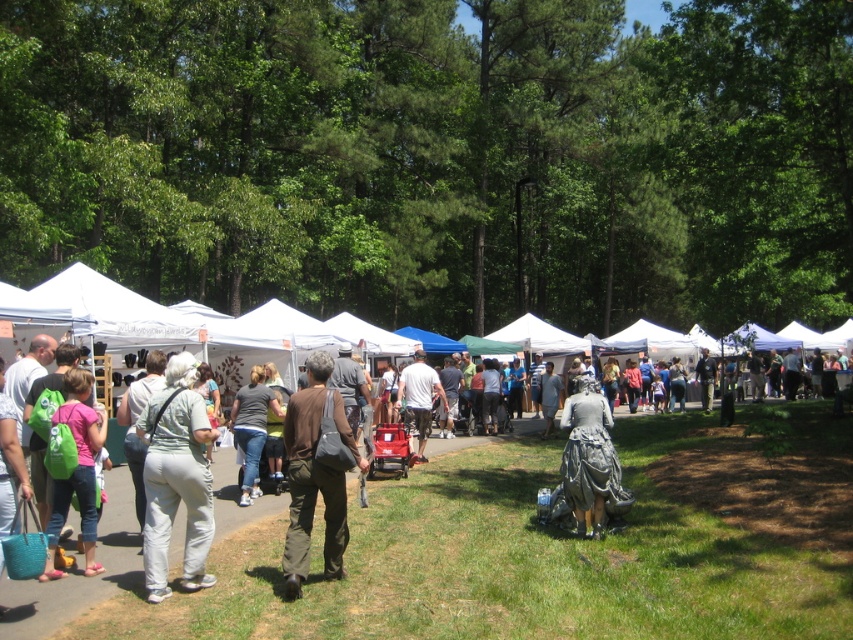
Question: Is white fabric tent at left to the left of matte gray lawn mower at center from the viewer's perspective?

Choices:
 (A) yes
 (B) no

Answer: (B)

Question: Is light gray pants at center smaller than shiny silver statue at center?

Choices:
 (A) yes
 (B) no

Answer: (B)

Question: Which point is closer to the camera?

Choices:
 (A) (241, 406)
 (B) (412, 417)
 (C) (583, 381)

Answer: (C)

Question: Which object is positioned farthest from the shiny silver statue at center?

Choices:
 (A) white fabric tent at left
 (B) green fabric backpack at lower left

Answer: (B)

Question: Which object appears farthest from the camera in this image?

Choices:
 (A) light gray pants at center
 (B) shiny silver statue at center
 (C) brown cotton shirt at center

Answer: (B)

Question: Does white fabric tent at left appear on the right side of brown cotton shirt at center?

Choices:
 (A) no
 (B) yes

Answer: (B)